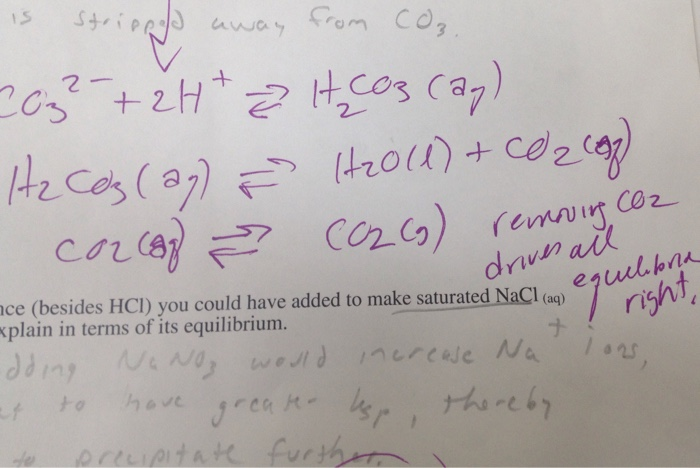
The width and height of the screenshot is (700, 468). Find the location of `looking straight down onto flat piece of paper`. looking straight down onto flat piece of paper is located at coordinates (671, 2).